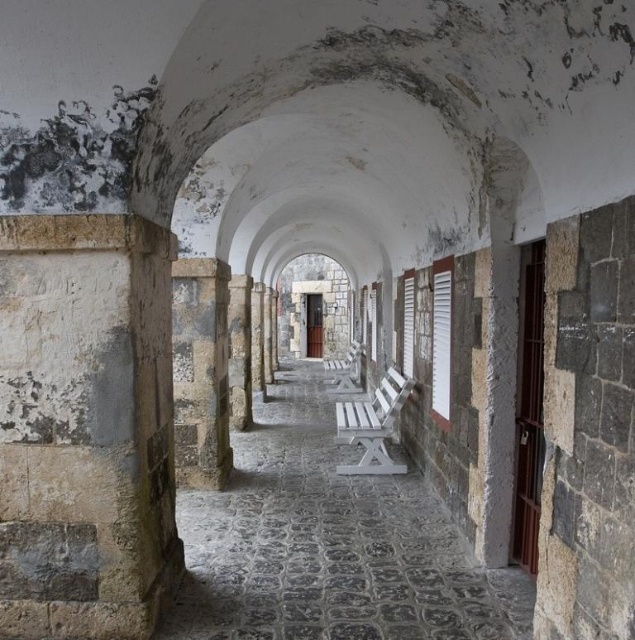
Question: Is white painted wood bench at center below stone textured pillar at center?

Choices:
 (A) yes
 (B) no

Answer: (A)

Question: Which of the following is the farthest from the observer?

Choices:
 (A) (236, 593)
 (B) (208, 355)

Answer: (B)

Question: Is white painted wood bench at center thinner than stone textured pillar at center?

Choices:
 (A) no
 (B) yes

Answer: (B)

Question: Can you confirm if white painted wood bench at center is positioned to the right of stone textured pillar at center?

Choices:
 (A) no
 (B) yes

Answer: (B)

Question: Which object is farther from the camera taking this photo?

Choices:
 (A) stone textured pillar at center
 (B) white painted wood bench at center

Answer: (B)